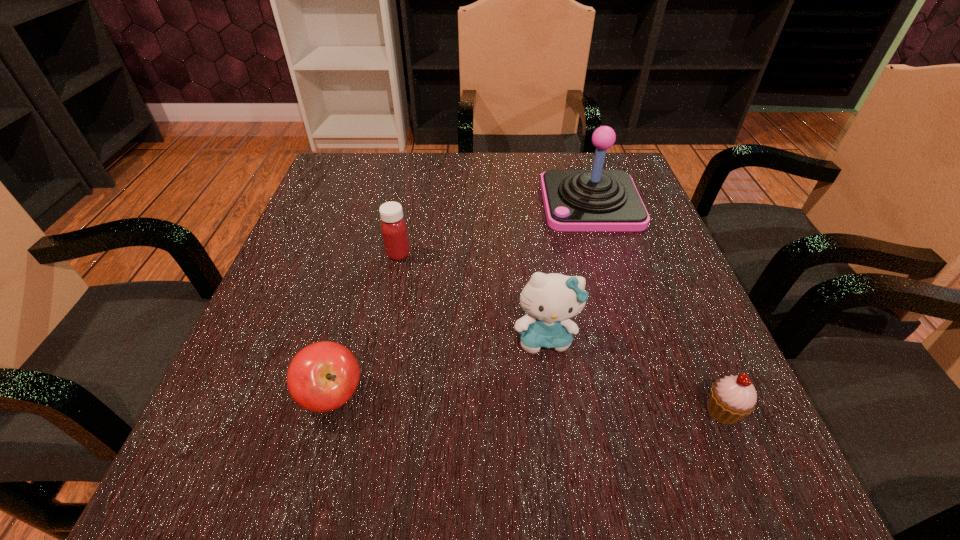
The height and width of the screenshot is (540, 960). What are the coordinates of `blank region between the cupcake and the fourth shortest object` in the screenshot? It's located at (634, 374).

Where is `empty location between the joystick and the fourth nearest object`? The image size is (960, 540). empty location between the joystick and the fourth nearest object is located at coordinates (494, 228).

Where is `free space between the apple and the medicine`? The image size is (960, 540). free space between the apple and the medicine is located at coordinates (366, 325).

Find the location of a particular element. Image resolution: width=960 pixels, height=540 pixels. free point between the farthest object and the cupcake is located at coordinates (657, 307).

In order to click on object that is the third closest to the apple in this screenshot , I will do `click(575, 200)`.

I want to click on the second closest object to the third nearest object, so click(x=323, y=376).

Identify the location of free space that satisfies the following two spatial constraints: 1. on the back side of the cupcake; 2. forward from the base of the joystick. (633, 202).

At what (x,y) coordinates should I click in order to perform the action: click on free region that satisfies the following two spatial constraints: 1. on the back side of the cupcake; 2. forward from the base of the farthest object. Please return your answer as a coordinate pair (x, y). Looking at the image, I should click on (633, 202).

This screenshot has width=960, height=540. Find the location of `free location that satisfies the following two spatial constraints: 1. forward from the base of the cupcake; 2. on the right side of the farthest object`. free location that satisfies the following two spatial constraints: 1. forward from the base of the cupcake; 2. on the right side of the farthest object is located at coordinates click(657, 411).

This screenshot has width=960, height=540. Identify the location of free region that satisfies the following two spatial constraints: 1. forward from the base of the tallest object; 2. on the face of the second tallest object. coord(633,337).